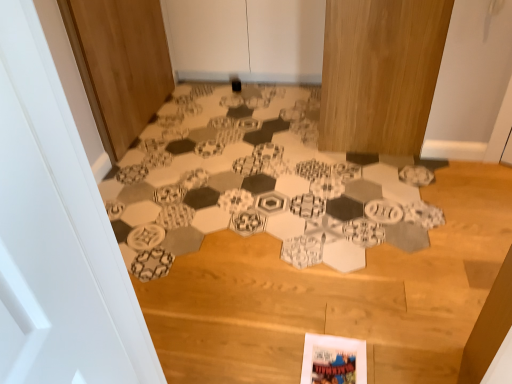
In order to click on free space above white paper at center (from a real-world perspective) in this screenshot , I will do `click(260, 163)`.